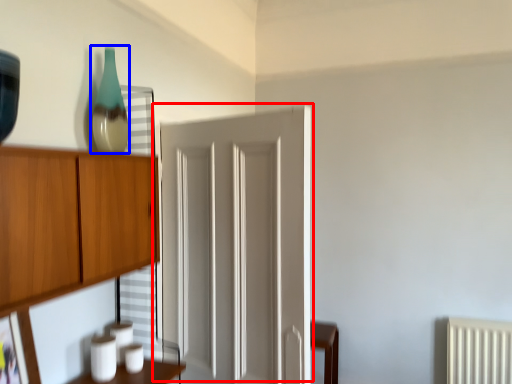
Question: Which object is closer to the camera taking this photo, door (highlighted by a red box) or glass vase (highlighted by a blue box)?

Choices:
 (A) door
 (B) glass vase

Answer: (A)